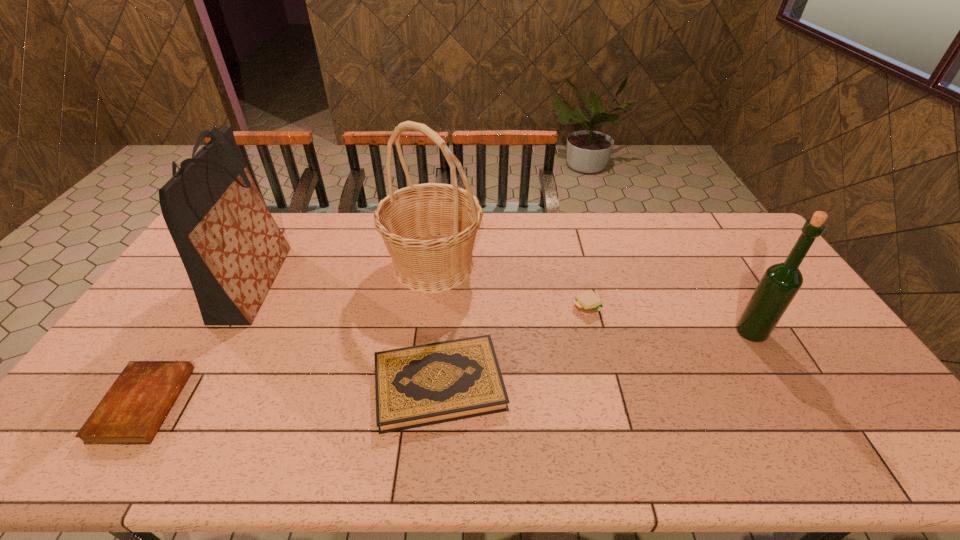
Image resolution: width=960 pixels, height=540 pixels. I want to click on basket, so click(429, 229).

Locate an element on the screen. shopping bag is located at coordinates (232, 249).

I want to click on liquor, so pos(780,283).

Locate an element on the screen. The height and width of the screenshot is (540, 960). the fourth shortest object is located at coordinates 780,283.

Where is `the fifth object from left to right`? the fifth object from left to right is located at coordinates (588, 302).

Where is `hardback book`? hardback book is located at coordinates (428, 384).

The width and height of the screenshot is (960, 540). I want to click on Bible, so click(131, 412).

At what (x,y) coordinates should I click in order to perform the action: click on blank area located on the left of the basket. Please return your answer as a coordinate pair (x, y). This screenshot has height=540, width=960. Looking at the image, I should click on (293, 265).

This screenshot has height=540, width=960. Identify the location of vacant space located on the front-facing side of the shopping bag. (335, 284).

Image resolution: width=960 pixels, height=540 pixels. I want to click on vacant point located 0.230m on the back of the rightmost object, so click(714, 271).